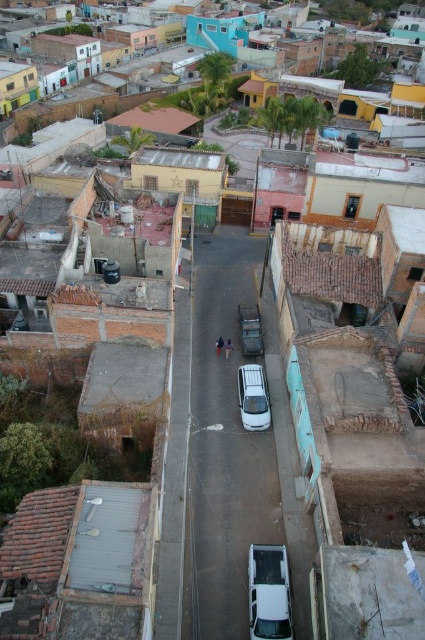
Question: Which point is closer to the camera?

Choices:
 (A) (272, 600)
 (B) (260, 381)

Answer: (A)

Question: Which of the following is the closest to the observer?

Choices:
 (A) white glossy car at center
 (B) white matte car at center

Answer: (A)

Question: From the image, what is the correct spatial relationship of white glossy car at center in relation to white matte car at center?

Choices:
 (A) below
 (B) above

Answer: (A)

Question: Is white glossy car at center in front of white matte car at center?

Choices:
 (A) no
 (B) yes

Answer: (B)

Question: Is white glossy car at center wider than white matte car at center?

Choices:
 (A) no
 (B) yes

Answer: (B)